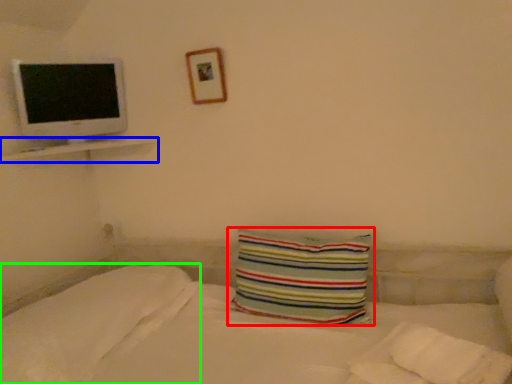
Question: Which is farther away from pillow (highlighted by a red box)? ledge (highlighted by a blue box) or pillow (highlighted by a green box)?

Choices:
 (A) ledge
 (B) pillow

Answer: (A)